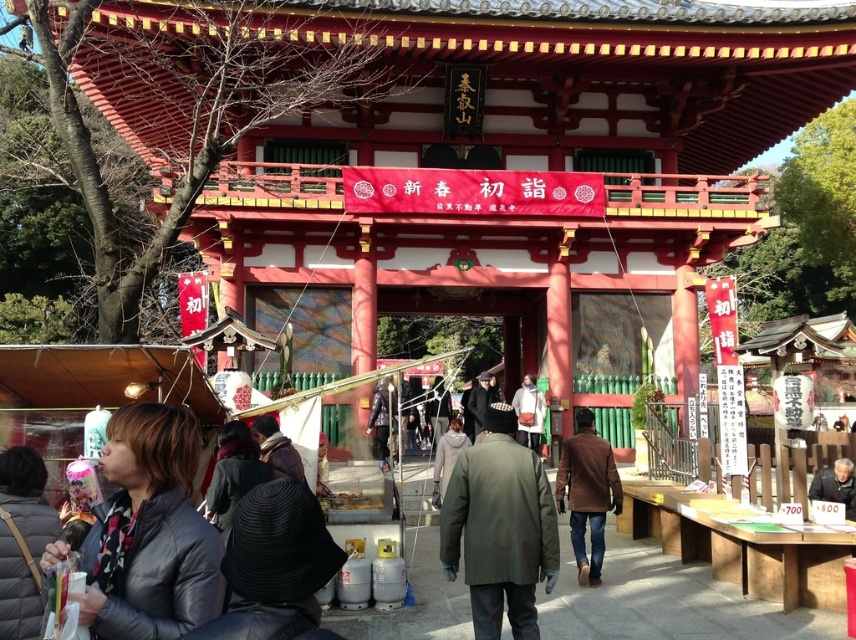
Is light brown wooden table at lower right smaller than white fabric bag at center?

No, light brown wooden table at lower right is not smaller than white fabric bag at center.

Is point (849, 508) closer to viewer compared to point (522, 426)?

Yes, point (849, 508) is in front of point (522, 426).

At what (x,y) coordinates should I click in order to perform the action: click on light brown wooden table at lower right. Please return your answer as a coordinate pair (x, y). The width and height of the screenshot is (856, 640). Looking at the image, I should click on (835, 484).

Is green matte coat at center wider than light brown wooden table at lower right?

Incorrect, green matte coat at center's width does not surpass light brown wooden table at lower right's.

Who is shorter, green matte coat at center or light brown wooden table at lower right?

Standing shorter between the two is green matte coat at center.

Which is in front, point (498, 410) or point (824, 481)?

Point (498, 410)

You are a GUI agent. You are given a task and a screenshot of the screen. Output one action in this format:
    pyautogui.click(x=<x>, y=<y>)
    Task: Click on the green matte coat at center
    
    Given the screenshot: What is the action you would take?
    (500, 528)

Who is positioned more to the right, leather jacket at lower left or brown leather jacket at center?

brown leather jacket at center

Is point (87, 554) in front of point (597, 458)?

Yes.

What do you see at coordinates (149, 532) in the screenshot? I see `leather jacket at lower left` at bounding box center [149, 532].

At what (x,y) coordinates should I click in order to perform the action: click on leather jacket at lower left. Please return your answer as a coordinate pair (x, y). This screenshot has height=640, width=856. Looking at the image, I should click on (149, 532).